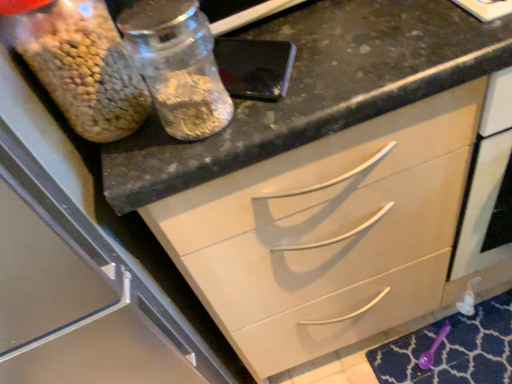
Locate an element on the screen. This screenshot has height=384, width=512. unoccupied region to the right of transparent glass jar at upper left is located at coordinates (322, 68).